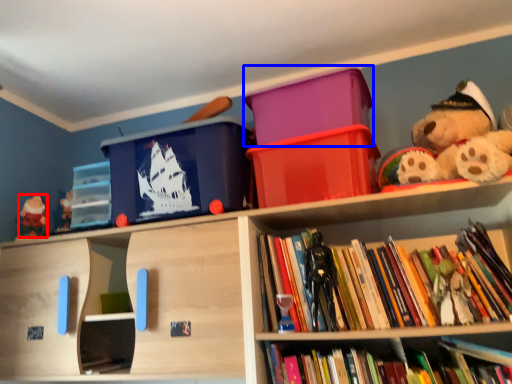
Question: Which of the following is the closest to the observer, toy (highlighted by a red box) or storage box (highlighted by a blue box)?

Choices:
 (A) toy
 (B) storage box

Answer: (B)